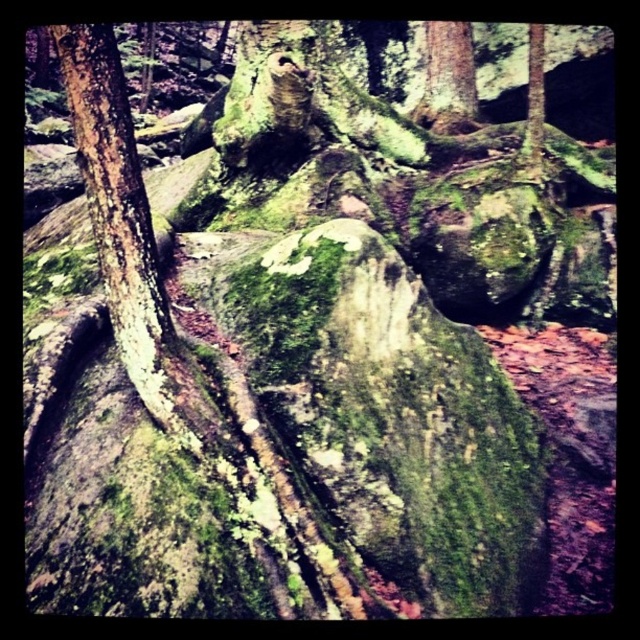
Question: Can you confirm if green mossy bark at left is positioned above smooth bark tree at upper center?

Choices:
 (A) no
 (B) yes

Answer: (A)

Question: Which object appears closest to the camera in this image?

Choices:
 (A) green mossy bark at left
 (B) smooth bark tree at upper center

Answer: (A)

Question: Can you confirm if green mossy bark at left is smaller than smooth bark tree at upper center?

Choices:
 (A) no
 (B) yes

Answer: (B)

Question: Does green mossy bark at left appear on the left side of smooth bark tree at upper center?

Choices:
 (A) yes
 (B) no

Answer: (A)

Question: Among these points, which one is farthest from the camera?

Choices:
 (A) (134, 202)
 (B) (468, 116)

Answer: (B)

Question: Which point is closer to the camera?

Choices:
 (A) (108, 106)
 (B) (467, 20)

Answer: (A)